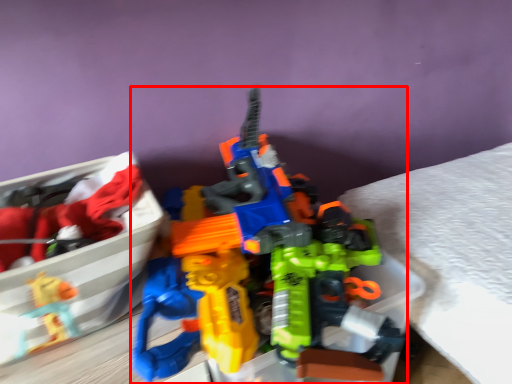
Question: In this image, where is toy (annotated by the red box) located relative to wide?

Choices:
 (A) right
 (B) left

Answer: (A)